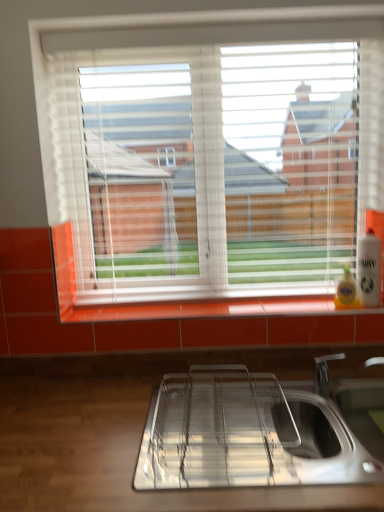
I want to click on white plastic blinds at upper center, so (208, 155).

In order to face white plastic bottle at right, should I rotate leftwards or rightwards?

To face it directly, rotate right by 22.130 degrees.

The width and height of the screenshot is (384, 512). What do you see at coordinates (369, 269) in the screenshot?
I see `white plastic bottle at right` at bounding box center [369, 269].

This screenshot has height=512, width=384. I want to click on white plastic blinds at upper center, so click(x=208, y=155).

Can you confirm if white plastic bottle at right is bigger than white plastic blinds at upper center?

No.

How much distance is there between white plastic bottle at right and white plastic blinds at upper center?

white plastic bottle at right is 24.75 inches from white plastic blinds at upper center.

Between white plastic bottle at right and white plastic blinds at upper center, which one has more height?

white plastic blinds at upper center is taller.

Locate an element on the screen. beverage beneath the white plastic blinds at upper center (from a real-world perspective) is located at coordinates (369, 269).

In terms of width, does polished stainless steel sink at lower center look wider or thinner when compared to white plastic bottle at right?

Considering their sizes, polished stainless steel sink at lower center looks broader than white plastic bottle at right.

Which of these two, polished stainless steel sink at lower center or white plastic bottle at right, is smaller?

Smaller between the two is white plastic bottle at right.

Is white plastic bottle at right located within polished stainless steel sink at lower center?

No, white plastic bottle at right is not inside polished stainless steel sink at lower center.

Is polished stainless steel sink at lower center looking in the opposite direction of white plastic bottle at right?

polished stainless steel sink at lower center does not have its back to white plastic bottle at right.

Is polished stainless steel sink at lower center facing towards white plastic blinds at upper center?

No, polished stainless steel sink at lower center does not turn towards white plastic blinds at upper center.

Identify the location of window on the left side of polished stainless steel sink at lower center. (208, 155).

Looking at this image, which object is wider, polished stainless steel sink at lower center or white plastic blinds at upper center?

polished stainless steel sink at lower center is wider.

From the image's perspective, does polished stainless steel sink at lower center appear higher than white plastic blinds at upper center?

Actually, polished stainless steel sink at lower center appears below white plastic blinds at upper center in the image.

Between point (221, 196) and point (370, 266), which one is positioned in front?

The point (370, 266) is in front.

From the image's perspective, is white plastic blinds at upper center located above or below white plastic bottle at right?

white plastic blinds at upper center is above white plastic bottle at right.

Find the location of a particular element. The image size is (384, 512). window that appears above the white plastic bottle at right (from the image's perspective) is located at coordinates (208, 155).

Is white plastic blinds at upper center positioned in front of white plastic bottle at right?

Yes, the depth of white plastic blinds at upper center is less than that of white plastic bottle at right.

Which object is further away from the camera taking this photo, white plastic bottle at right or polished stainless steel sink at lower center?

white plastic bottle at right is behind.

Which point is more distant from viewer, (370,275) or (237,414)?

Positioned behind is point (370,275).

Where is `sink located underneath the white plastic bottle at right (from a real-world perspective)`? The width and height of the screenshot is (384, 512). sink located underneath the white plastic bottle at right (from a real-world perspective) is located at coordinates (253, 431).

Which is more to the left, white plastic blinds at upper center or polished stainless steel sink at lower center?

white plastic blinds at upper center is more to the left.

Is there a large distance between white plastic blinds at upper center and polished stainless steel sink at lower center?

No, white plastic blinds at upper center is not far from polished stainless steel sink at lower center.

From the image's perspective, relative to polished stainless steel sink at lower center, is white plastic blinds at upper center above or below?

From the image's perspective, white plastic blinds at upper center appears above polished stainless steel sink at lower center.

From a real-world perspective, is white plastic blinds at upper center over polished stainless steel sink at lower center?

Yes, from a real-world perspective, white plastic blinds at upper center is on top of polished stainless steel sink at lower center.

Locate an element on the screen. The image size is (384, 512). window in front of the white plastic bottle at right is located at coordinates (208, 155).

Locate an element on the screen. Image resolution: width=384 pixels, height=512 pixels. sink located underneath the white plastic bottle at right (from a real-world perspective) is located at coordinates click(253, 431).

Considering their positions, is polished stainless steel sink at lower center positioned further to white plastic bottle at right than white plastic blinds at upper center?

white plastic blinds at upper center is further to white plastic bottle at right.

Which object lies further to the anchor point polished stainless steel sink at lower center, white plastic blinds at upper center or white plastic bottle at right?

white plastic blinds at upper center is positioned further to the anchor polished stainless steel sink at lower center.

When comparing their distances from white plastic blinds at upper center, does polished stainless steel sink at lower center or white plastic bottle at right seem further?

Based on the image, white plastic bottle at right appears to be further to white plastic blinds at upper center.

Looking at the image, which one is located closer to polished stainless steel sink at lower center, white plastic bottle at right or white plastic blinds at upper center?

white plastic bottle at right lies closer to polished stainless steel sink at lower center than the other object.

Based on their spatial positions, is white plastic blinds at upper center or polished stainless steel sink at lower center closer to white plastic bottle at right?

Based on the image, polished stainless steel sink at lower center appears to be nearer to white plastic bottle at right.

Looking at the image, which one is located further to white plastic blinds at upper center, white plastic bottle at right or polished stainless steel sink at lower center?

Based on the image, white plastic bottle at right appears to be further to white plastic blinds at upper center.

Where is `beverage between white plastic blinds at upper center and polished stainless steel sink at lower center in the vertical direction`? beverage between white plastic blinds at upper center and polished stainless steel sink at lower center in the vertical direction is located at coordinates (369, 269).